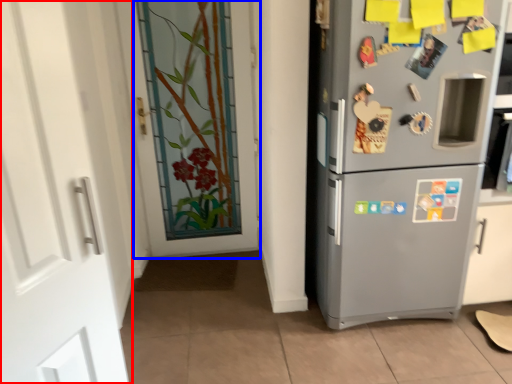
Question: Which object is further to the camera taking this photo, door (highlighted by a red box) or door (highlighted by a blue box)?

Choices:
 (A) door
 (B) door

Answer: (B)